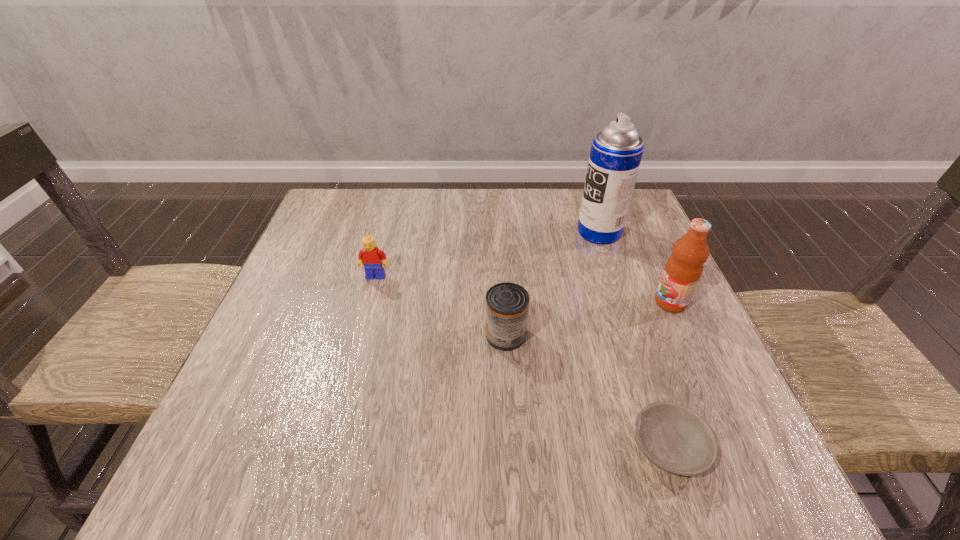
Locate an element on the screen. object located in the near edge section of the desktop is located at coordinates (674, 438).

Where is `aerosol can situated at the right edge`? The image size is (960, 540). aerosol can situated at the right edge is located at coordinates (616, 152).

Where is `fruit juice positioned at the right edge`? fruit juice positioned at the right edge is located at coordinates (682, 272).

This screenshot has width=960, height=540. In order to click on bowl at the right edge in this screenshot , I will do `click(674, 438)`.

The height and width of the screenshot is (540, 960). I want to click on object that is at the far right corner, so click(x=616, y=152).

The image size is (960, 540). Identify the location of object situated at the near right corner. (674, 438).

You are a GUI agent. You are given a task and a screenshot of the screen. Output one action in this format:
    pyautogui.click(x=<x>, y=<y>)
    Task: Click on the vacant area at the far edge of the desktop
    This screenshot has width=960, height=540.
    Given the screenshot: What is the action you would take?
    pyautogui.click(x=423, y=234)

Image resolution: width=960 pixels, height=540 pixels. I want to click on vacant space at the near edge, so [520, 448].

Locate an element on the screen. vacant space at the left edge of the desktop is located at coordinates (263, 334).

In the image, there is a desktop. What are the coordinates of `vacant space at the right edge` in the screenshot? It's located at (639, 248).